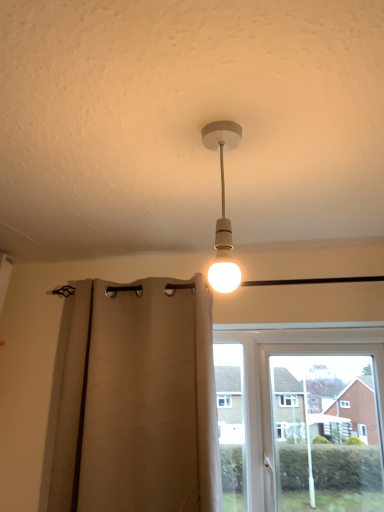
Question: Is white plastic window at center a part of white matte bulb at center?

Choices:
 (A) no
 (B) yes

Answer: (A)

Question: From the image's perspective, is white matte bulb at center beneath white plastic window at center?

Choices:
 (A) yes
 (B) no

Answer: (B)

Question: Does white matte bulb at center lie in front of white plastic window at center?

Choices:
 (A) no
 (B) yes

Answer: (B)

Question: Is white matte bulb at center beside white plastic window at center?

Choices:
 (A) no
 (B) yes

Answer: (A)

Question: Does white matte bulb at center appear on the left side of white plastic window at center?

Choices:
 (A) no
 (B) yes

Answer: (B)

Question: From a real-world perspective, is beige fabric curtain at center physically located above or below white plastic window at center?

Choices:
 (A) above
 (B) below

Answer: (A)

Question: Do you think beige fabric curtain at center is within white plastic window at center, or outside of it?

Choices:
 (A) outside
 (B) inside

Answer: (A)

Question: Considering the relative positions of beige fabric curtain at center and white plastic window at center in the image provided, is beige fabric curtain at center to the left or to the right of white plastic window at center?

Choices:
 (A) left
 (B) right

Answer: (A)

Question: In terms of height, does beige fabric curtain at center look taller or shorter compared to white plastic window at center?

Choices:
 (A) short
 (B) tall

Answer: (B)

Question: Considering the positions of point (221, 269) and point (157, 310), is point (221, 269) closer or farther from the camera than point (157, 310)?

Choices:
 (A) closer
 (B) farther

Answer: (A)

Question: Is white matte bulb at center taller or shorter than beige fabric curtain at center?

Choices:
 (A) short
 (B) tall

Answer: (A)

Question: In terms of size, does white matte bulb at center appear bigger or smaller than beige fabric curtain at center?

Choices:
 (A) small
 (B) big

Answer: (A)

Question: Visually, is white matte bulb at center positioned to the left or to the right of beige fabric curtain at center?

Choices:
 (A) right
 (B) left

Answer: (A)

Question: Considering the relative positions of white plastic window at center and white matte bulb at center in the image provided, is white plastic window at center to the left or to the right of white matte bulb at center?

Choices:
 (A) left
 (B) right

Answer: (B)

Question: From the image's perspective, is white plastic window at center positioned above or below white matte bulb at center?

Choices:
 (A) below
 (B) above

Answer: (A)